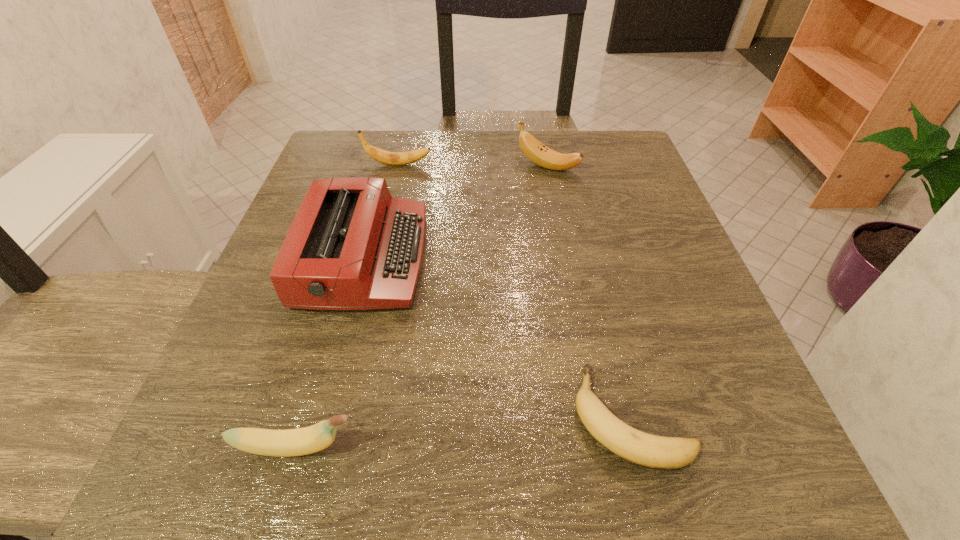
Locate an element on the screen. typewriter is located at coordinates (352, 246).

Where is `the shortest object`? This screenshot has width=960, height=540. the shortest object is located at coordinates (652, 451).

At what (x,y) coordinates should I click in order to perform the action: click on vacant space situated 0.300m on the typing side of the third nearest object. Please return your answer as a coordinate pair (x, y). Looking at the image, I should click on (588, 258).

You are a GUI agent. You are given a task and a screenshot of the screen. Output one action in this format:
    pyautogui.click(x=<x>, y=<y>)
    Task: Click on the vacant region located 0.330m on the back of the shortest object
    
    Given the screenshot: What is the action you would take?
    pyautogui.click(x=583, y=225)

Locate an element on the screen. The width and height of the screenshot is (960, 540). typewriter that is at the left edge is located at coordinates (352, 246).

Locate an element on the screen. Image resolution: width=960 pixels, height=540 pixels. object that is at the far left corner is located at coordinates (389, 158).

Find the location of a particular element. The height and width of the screenshot is (540, 960). object present at the near left corner is located at coordinates (302, 441).

Where is `object that is positioned at the far right corner`? This screenshot has width=960, height=540. object that is positioned at the far right corner is located at coordinates (537, 152).

The width and height of the screenshot is (960, 540). Identify the location of object located in the near right corner section of the desktop. (652, 451).

The image size is (960, 540). In order to click on free space at the far edge in this screenshot , I will do `click(496, 136)`.